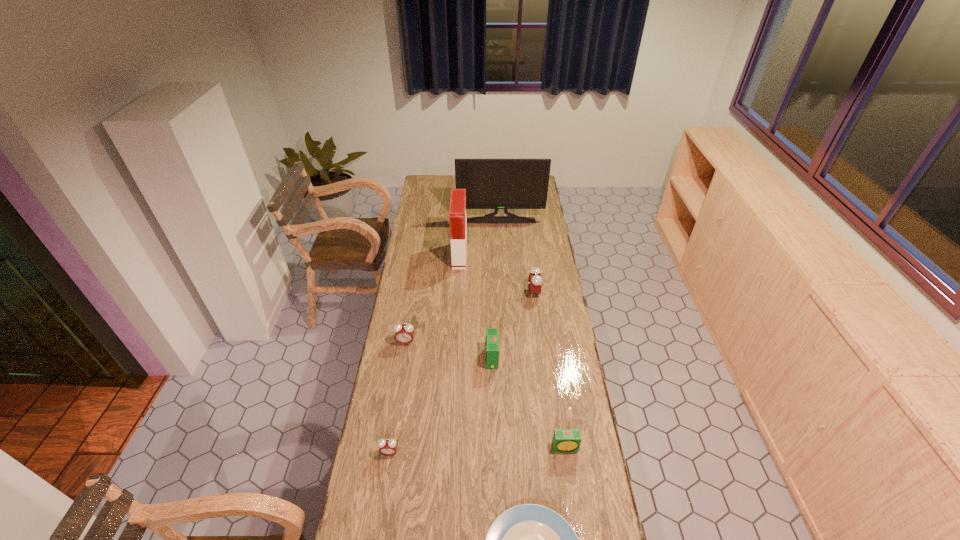
Locate an element on the screen. Image resolution: width=960 pixels, height=540 pixels. the smaller green alarm clock is located at coordinates (564, 440).

Where is `the nearer green alarm clock`? The width and height of the screenshot is (960, 540). the nearer green alarm clock is located at coordinates (564, 440).

The width and height of the screenshot is (960, 540). Identify the location of vacant area situated on the front-facing side of the monitor. (502, 243).

Where is `vacant area situated 0.160m on the front-facing side of the cigarette_case`? The image size is (960, 540). vacant area situated 0.160m on the front-facing side of the cigarette_case is located at coordinates (497, 256).

Identify the location of free space located 0.320m on the clock face of the tallest alarm clock. (461, 293).

This screenshot has height=540, width=960. In order to click on vacant region located on the clock face of the tallest alarm clock in this screenshot , I will do coord(471,293).

The width and height of the screenshot is (960, 540). Find the location of `blank area located on the clock face of the tallest alarm clock`. blank area located on the clock face of the tallest alarm clock is located at coordinates (468, 293).

Where is `free space located 0.100m on the clock face of the fourth farthest object`? This screenshot has width=960, height=540. free space located 0.100m on the clock face of the fourth farthest object is located at coordinates (402, 366).

Locate an element on the screen. Image resolution: width=960 pixels, height=540 pixels. free location located on the front-facing side of the third alarm clock from right to left is located at coordinates (442, 358).

The height and width of the screenshot is (540, 960). I want to click on blank area located on the front-facing side of the third alarm clock from right to left, so click(x=470, y=358).